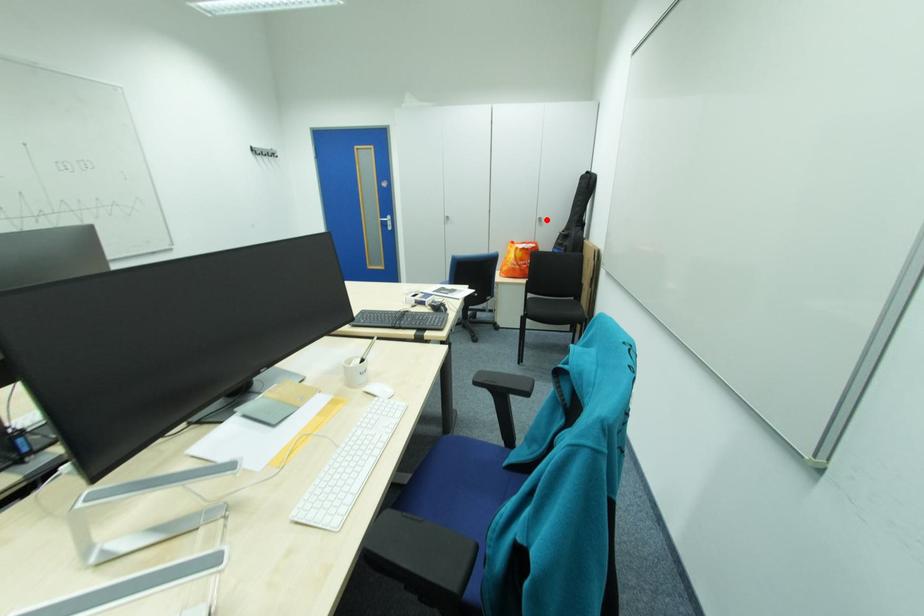
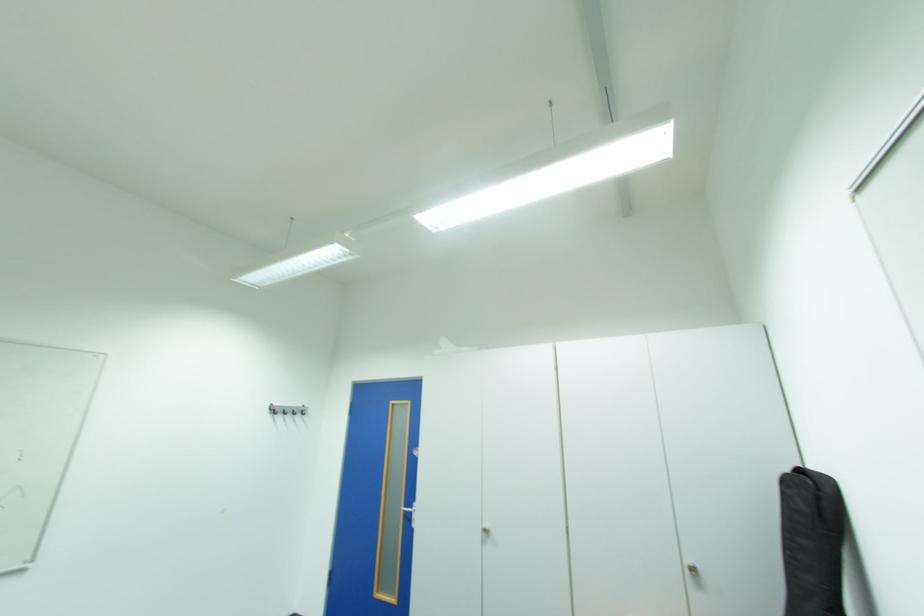
Question: I am providing you with two images of the same scene from different viewpoints. A red point is shown in image1. For the corresponding object point in image2, is it positioned nearer or farther from the camera?

Choices:
 (A) Nearer
 (B) Farther

Answer: (B)